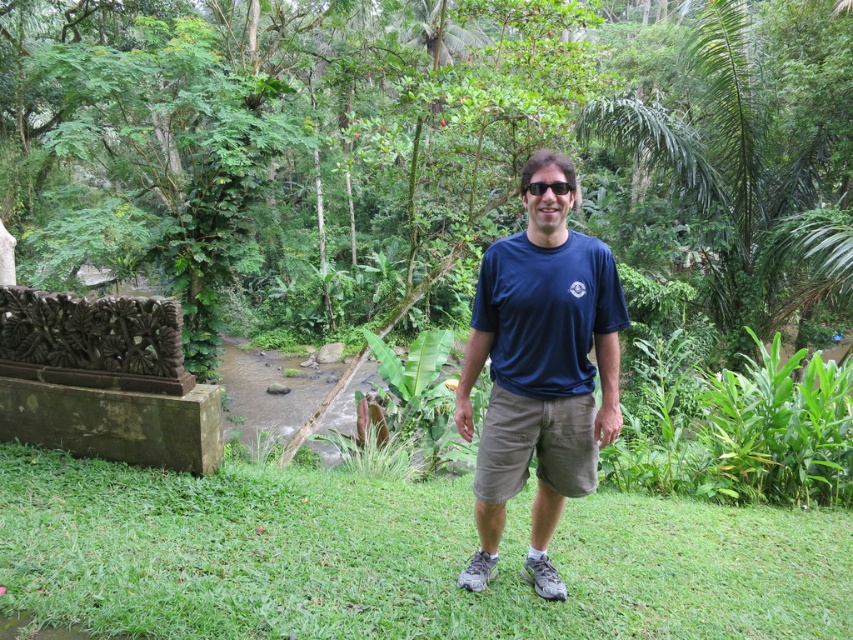
Can you confirm if green grass at center is wider than green leafy tree at center?

Yes.

Which is in front, point (288, 499) or point (730, 81)?

Point (288, 499) is more forward.

The width and height of the screenshot is (853, 640). What are the coordinates of `green grass at center` in the screenshot? It's located at (395, 557).

Between point (769, 170) and point (564, 180), which one is positioned behind?

Point (769, 170)

Measure the distance between green leafy tree at center and camera.

green leafy tree at center and camera are 12.25 meters apart.

Between point (805, 120) and point (543, 189), which one is positioned in front?

Point (543, 189)

Where is `green leafy tree at center`? The image size is (853, 640). green leafy tree at center is located at coordinates (757, 161).

Which is more to the left, green grass at center or black plastic sunglasses at center?

green grass at center is more to the left.

Find the location of a particular element. The width and height of the screenshot is (853, 640). green grass at center is located at coordinates tap(395, 557).

Locate an element on the screen. green grass at center is located at coordinates (395, 557).